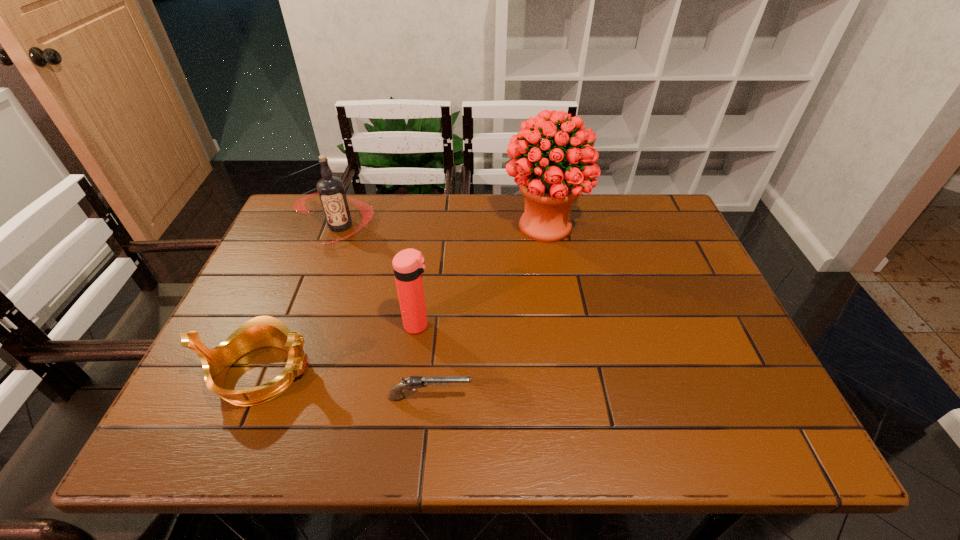
In the image, there is a desktop. At what (x,y) coordinates should I click in order to perform the action: click on vacant space at the left edge. Please return your answer as a coordinate pair (x, y). The width and height of the screenshot is (960, 540). Looking at the image, I should click on (262, 309).

The height and width of the screenshot is (540, 960). Identify the location of free location at the right edge. (668, 338).

In the image, there is a desktop. Where is `vacant space at the far left corner`? vacant space at the far left corner is located at coordinates (328, 231).

This screenshot has height=540, width=960. Find the location of `vacant space at the near left corner`. vacant space at the near left corner is located at coordinates [x=178, y=429].

I want to click on vacant region at the far right corner of the desktop, so click(664, 233).

Where is `free space between the thermos bottle and the tiara`? This screenshot has height=540, width=960. free space between the thermos bottle and the tiara is located at coordinates (340, 349).

Locate an element on the screen. vacant space that's between the bouquet and the third farthest object is located at coordinates (481, 275).

I want to click on vacant space in between the second shortest object and the third farthest object, so click(x=340, y=349).

This screenshot has width=960, height=540. I want to click on free spot between the shortest object and the root beer, so click(x=385, y=312).

The image size is (960, 540). I want to click on vacant point located between the root beer and the rightmost object, so click(443, 226).